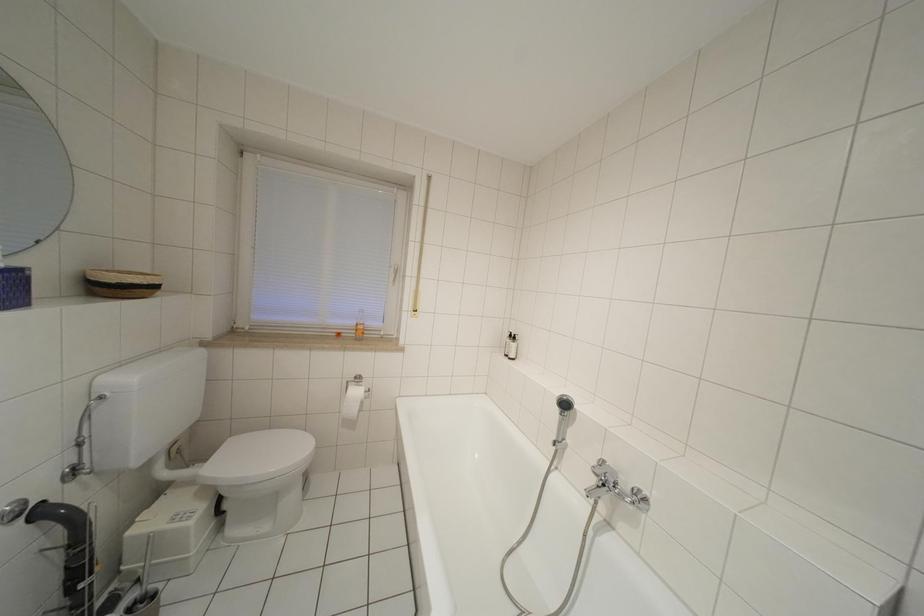
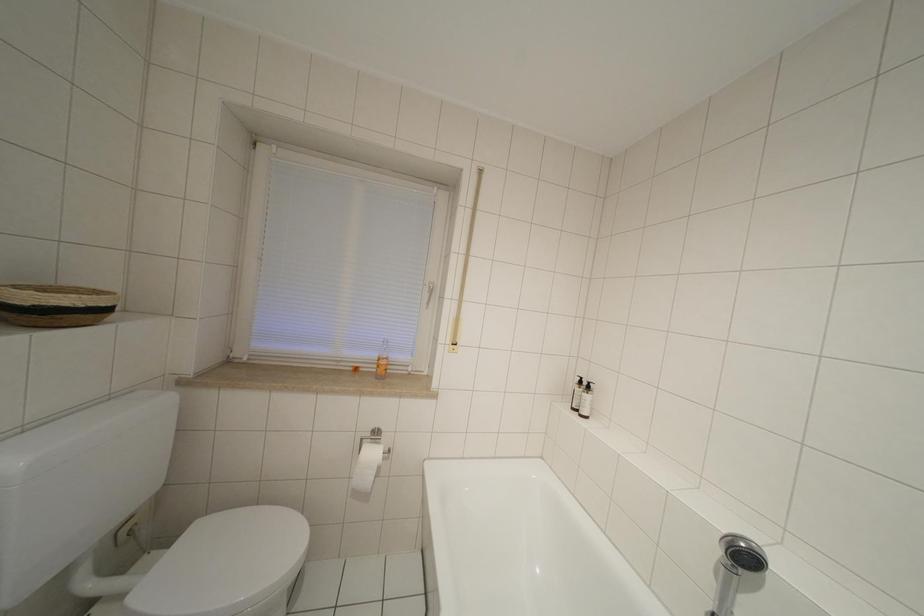
What movement of the cameraman would produce the second image?

The movement direction of the cameraman is left, forward.